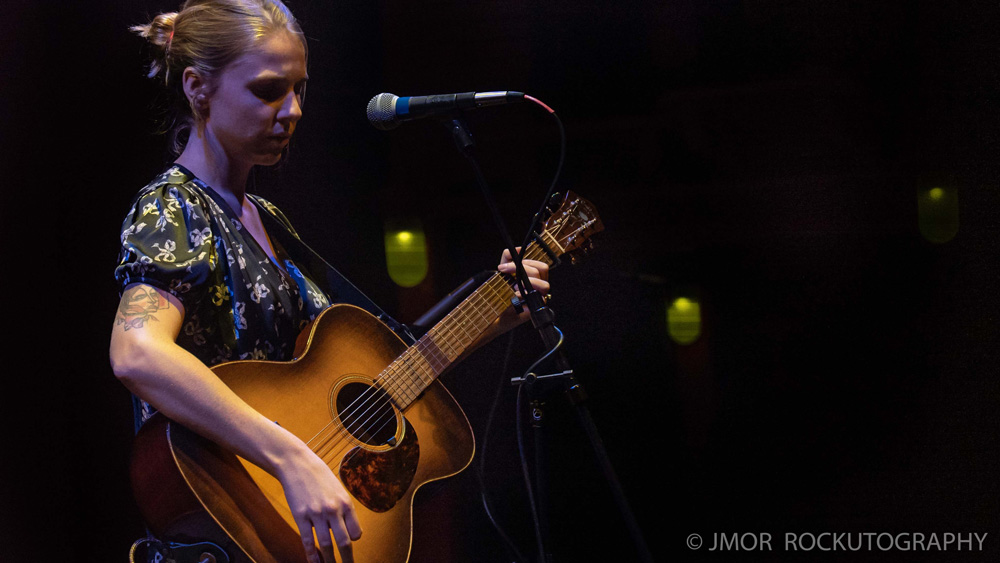
Where is `lights`? This screenshot has height=563, width=1000. lights is located at coordinates (685, 325).